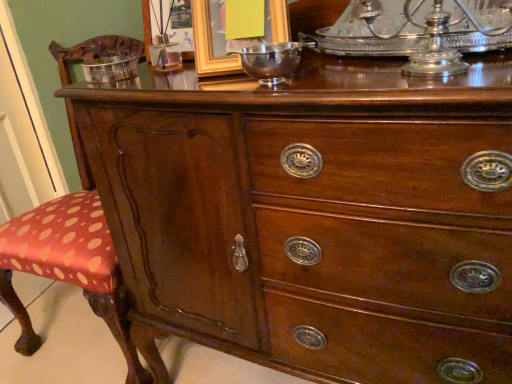
Locate an element on the screen. This screenshot has width=512, height=384. empty space that is in between shiny silver bowl at center and silver metallic bowl at upper left is located at coordinates (182, 81).